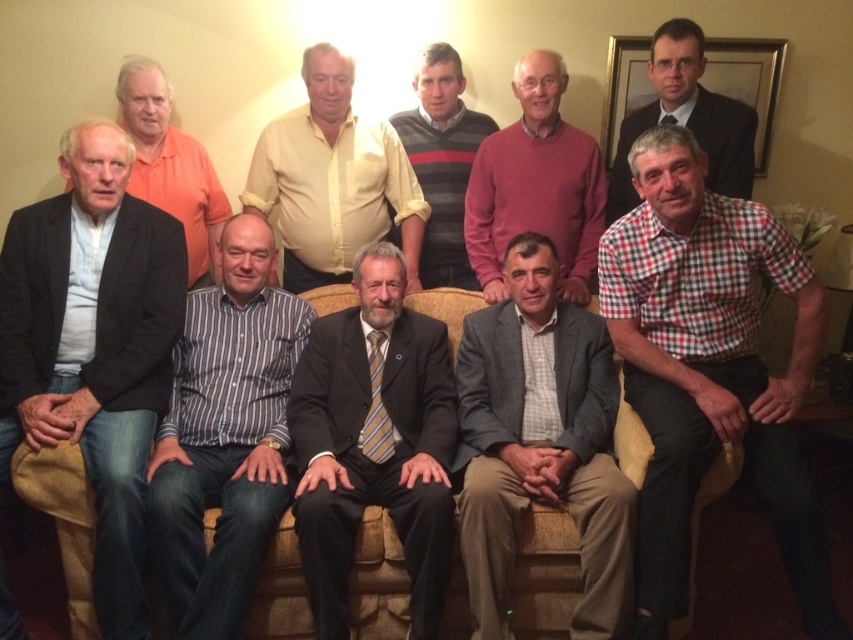
Question: Does red checkered shirt at lower right appear under black cotton jacket at left?

Choices:
 (A) yes
 (B) no

Answer: (A)

Question: Which point is farther to the camera?

Choices:
 (A) (170, 180)
 (B) (48, 465)

Answer: (A)

Question: Which of the following is the farthest from the observer?

Choices:
 (A) (126, 92)
 (B) (460, 262)

Answer: (B)

Question: Is red checkered shirt at lower right above white shirt at left?

Choices:
 (A) yes
 (B) no

Answer: (B)

Question: Which point appears closest to the camera in this image?

Choices:
 (A) (386, 388)
 (B) (332, 292)
 (C) (216, 621)

Answer: (C)

Question: Is brown fabric couch at center in front of pink sweater at upper center?

Choices:
 (A) yes
 (B) no

Answer: (A)